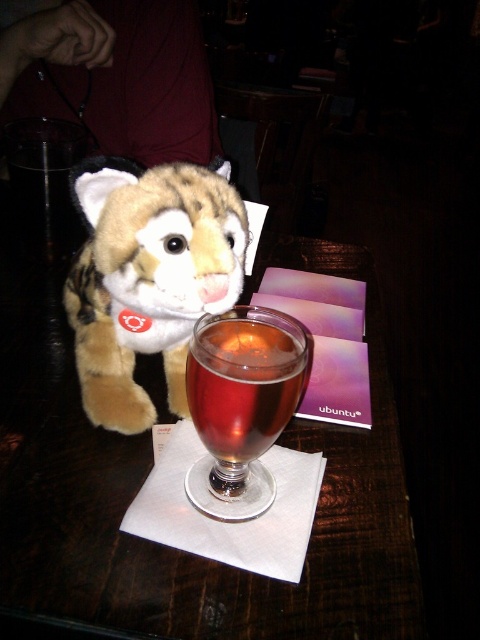
Question: Can you confirm if wooden table at center is smaller than fuzzy brown plush toy at upper left?

Choices:
 (A) no
 (B) yes

Answer: (A)

Question: Is wooden table at center smaller than translucent glass wine glass at center?

Choices:
 (A) yes
 (B) no

Answer: (B)

Question: Which point appears farthest from the camera in this image?

Choices:
 (A) (260, 436)
 (B) (278, 605)
 (C) (135, 276)

Answer: (C)

Question: Among these points, which one is farthest from the camera?

Choices:
 (A) click(87, 412)
 (B) click(122, 568)
 (C) click(220, 438)

Answer: (A)

Question: Is wooden table at center positioned in front of translucent glass wine glass at center?

Choices:
 (A) no
 (B) yes

Answer: (B)

Question: Which is farther from the fuzzy brown plush toy at upper left?

Choices:
 (A) translucent glass wine glass at center
 (B) wooden table at center

Answer: (B)